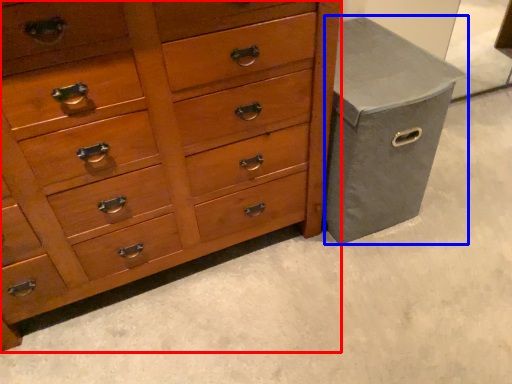
Question: Among these objects, which one is farthest to the camera, chest of drawers (highlighted by a red box) or gray (highlighted by a blue box)?

Choices:
 (A) chest of drawers
 (B) gray

Answer: (B)